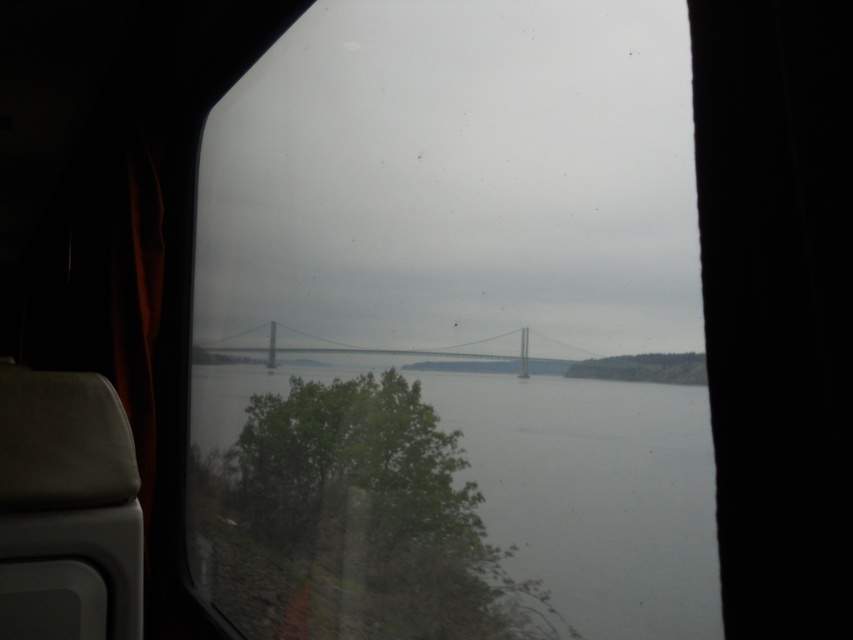
Question: Among these points, which one is farthest from the camera?

Choices:
 (A) (341, 406)
 (B) (463, 397)
 (C) (276, 353)

Answer: (C)

Question: Can you confirm if transparent glass window at center is thinner than gray metallic bridge at center?

Choices:
 (A) no
 (B) yes

Answer: (A)

Question: Is transparent glass window at center below gray water at center?

Choices:
 (A) no
 (B) yes

Answer: (A)

Question: Based on their relative distances, which object is nearer to the gray water at center?

Choices:
 (A) gray metallic bridge at center
 (B) transparent glass window at center

Answer: (B)

Question: Does gray water at center lie behind gray metallic bridge at center?

Choices:
 (A) yes
 (B) no

Answer: (B)

Question: Which object is closer to the camera taking this photo?

Choices:
 (A) transparent glass window at center
 (B) gray metallic bridge at center
 (C) gray water at center

Answer: (A)